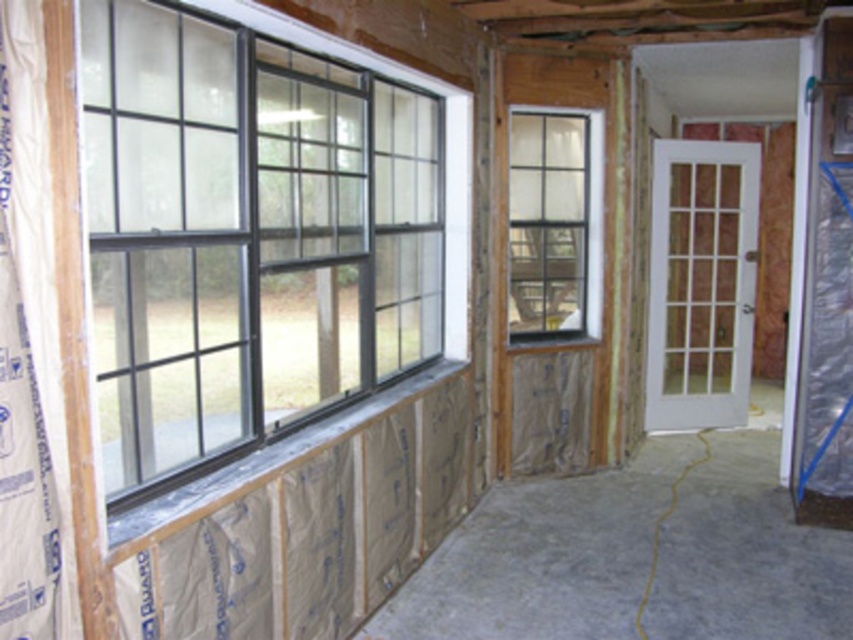
Question: Which point is closer to the camera?

Choices:
 (A) clear glass window at center
 (B) black matte window at left

Answer: (B)

Question: Can you confirm if black matte window at left is positioned to the right of clear glass window at center?

Choices:
 (A) yes
 (B) no

Answer: (B)

Question: Does black matte window at left have a greater width compared to clear glass window at center?

Choices:
 (A) no
 (B) yes

Answer: (B)

Question: Does black matte window at left appear on the right side of clear glass window at center?

Choices:
 (A) no
 (B) yes

Answer: (A)